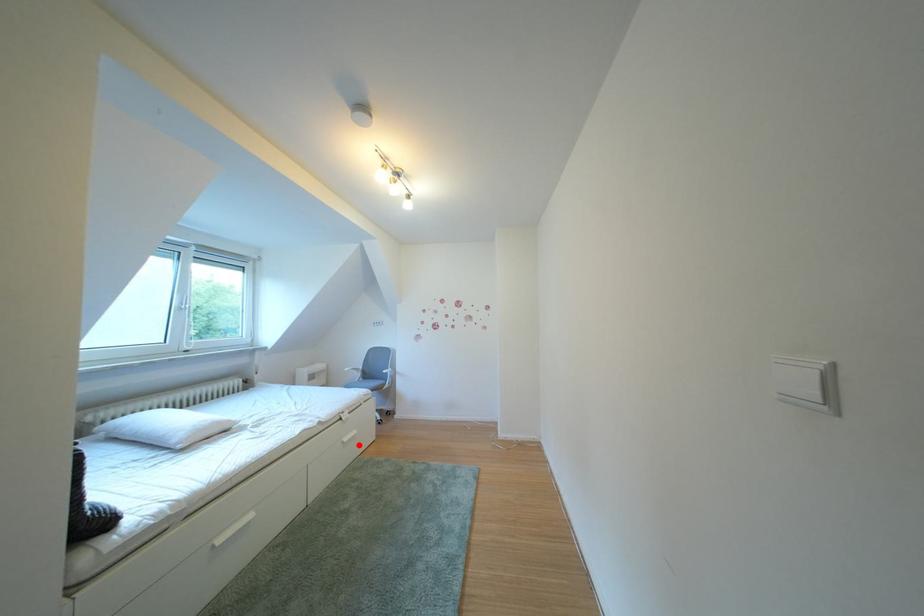
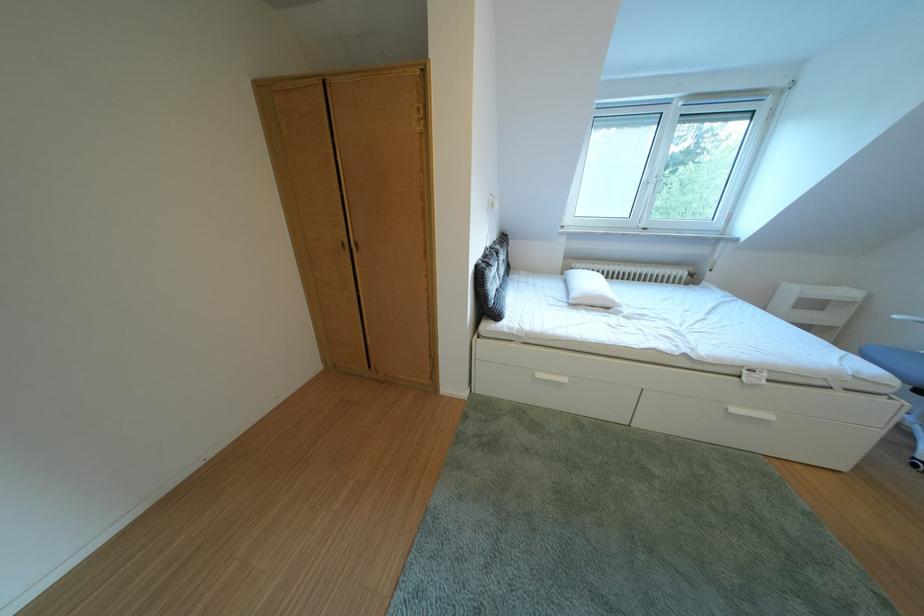
Question: I am providing you with two images of the same scene from different viewpoints. In image1, a red point is highlighted. Considering the same 3D point in image2, which of the following is correct?

Choices:
 (A) It is closer
 (B) It is farther

Answer: (B)